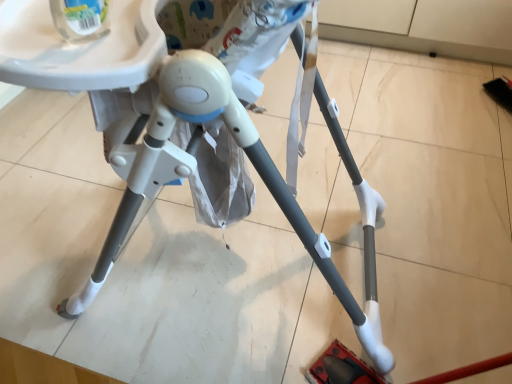
The height and width of the screenshot is (384, 512). In order to click on white plastic tripod at center in this screenshot , I will do `click(205, 139)`.

Describe the element at coordinates (205, 139) in the screenshot. I see `white plastic tripod at center` at that location.

Locate an element on the screen. white plastic tripod at center is located at coordinates (205, 139).